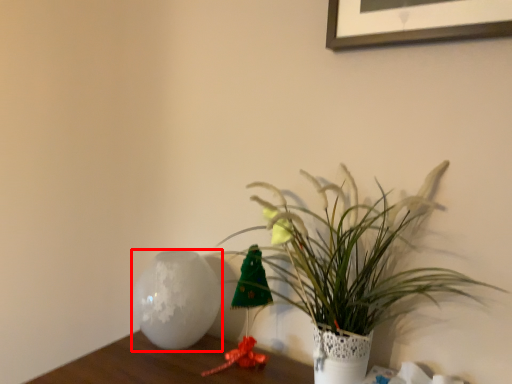
Question: From the image's perspective, where is vase (annotated by the red box) located in relation to houseplant in the image?

Choices:
 (A) above
 (B) below

Answer: (B)